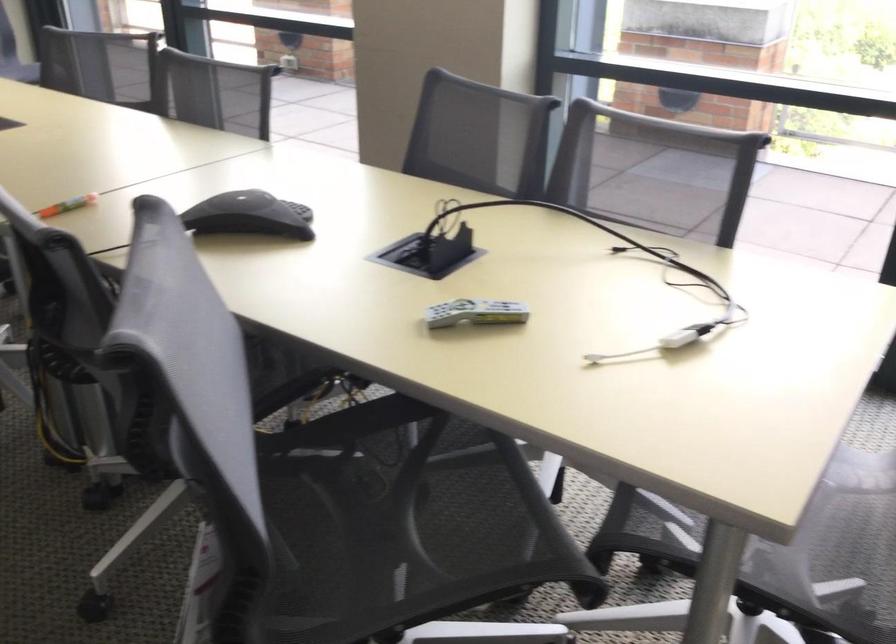
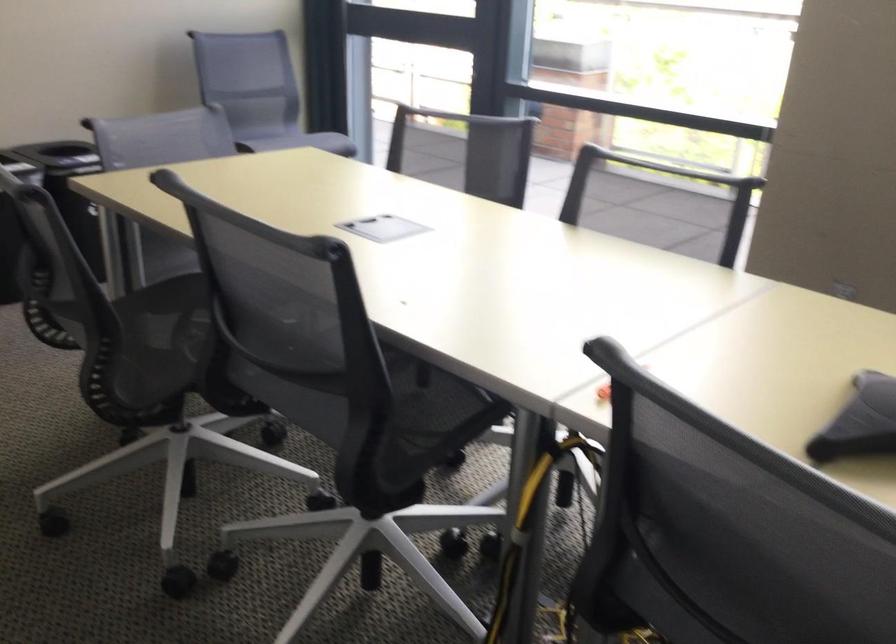
Question: The camera is either moving clockwise (left) or counter-clockwise (right) around the object. The first image is from the beginning of the video and the second image is from the end. Is the camera moving left or right when shooting the video?

Choices:
 (A) Left
 (B) Right

Answer: (B)